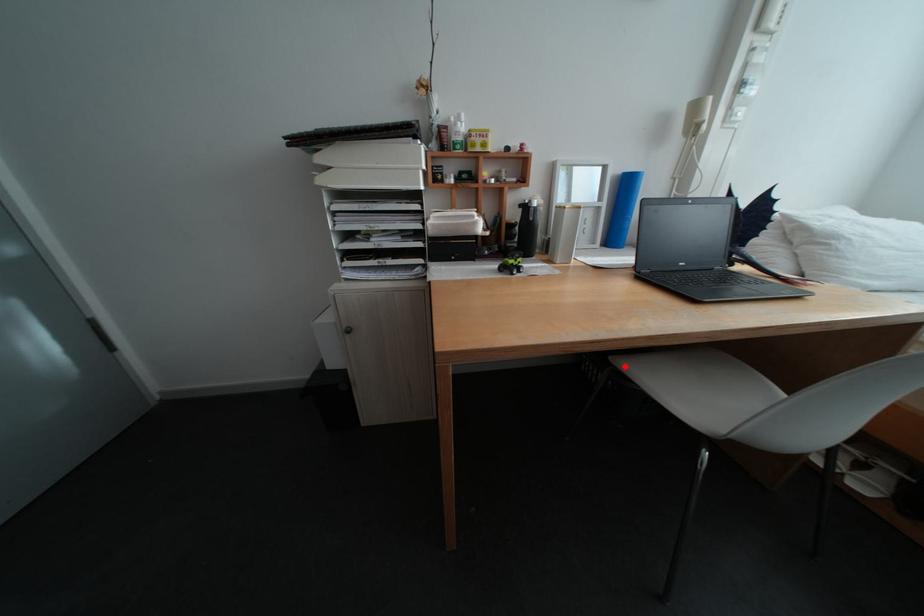
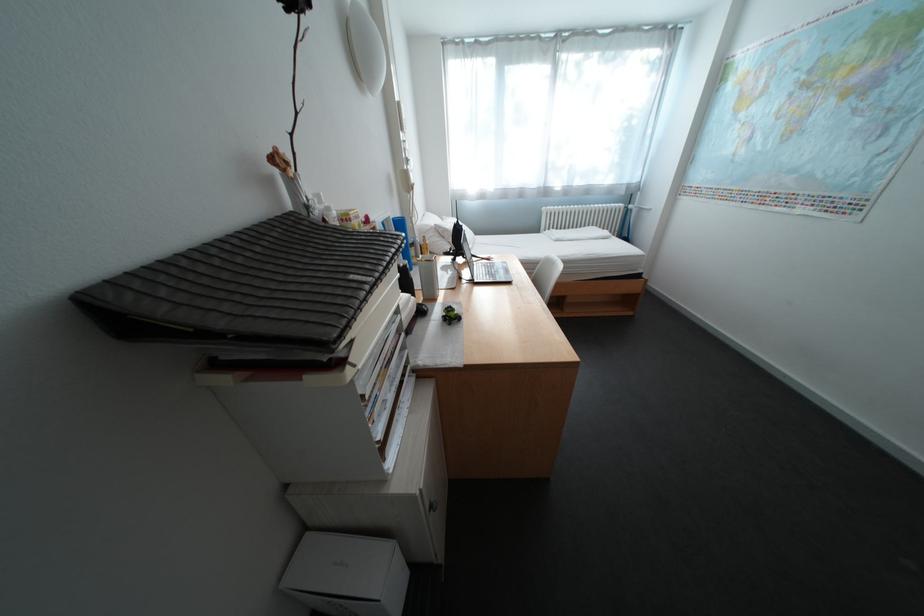
Question: I am providing you with two images of the same scene from different viewpoints. A red point is marked on the first image. At the location where the point appears in image 1, is it still visible in image 2?

Choices:
 (A) Yes
 (B) No

Answer: (B)